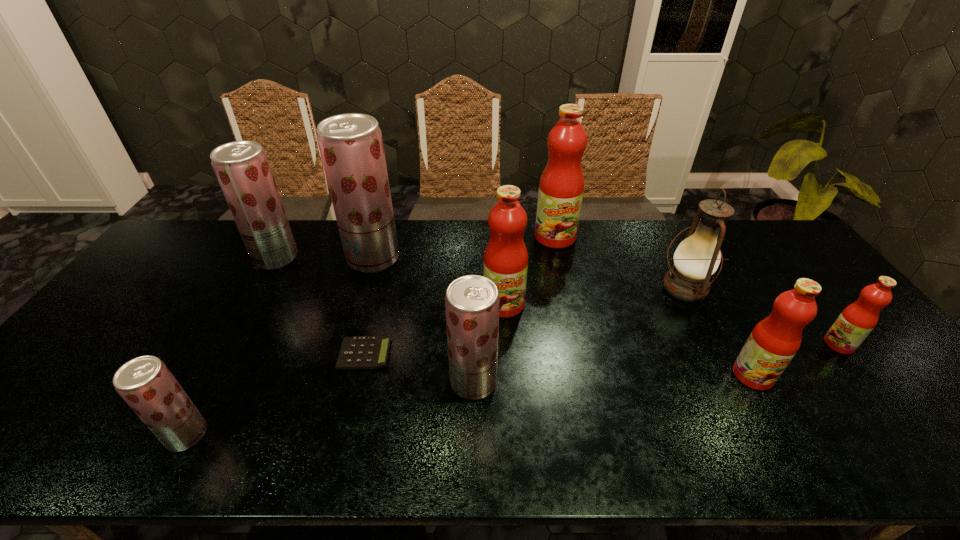
Where is `empty space between the third smallest strawberry fruit juice and the rightmost strawberry fruit juice`? empty space between the third smallest strawberry fruit juice and the rightmost strawberry fruit juice is located at coordinates (374, 320).

Where is `empty space between the nearest pink fruit juice and the shortest object`? This screenshot has height=540, width=960. empty space between the nearest pink fruit juice and the shortest object is located at coordinates (559, 364).

Find the location of a particular element. vacant space in between the third biggest strawberry fruit juice and the nearest strawberry fruit juice is located at coordinates (330, 408).

The width and height of the screenshot is (960, 540). What are the coordinates of `unoccupied area between the fourth object from right to left and the second biggest strawberry fruit juice` in the screenshot? It's located at (416, 247).

What are the coordinates of `vacant space that is in between the nearest strawberry fruit juice and the biggest pink fruit juice` in the screenshot? It's located at (371, 336).

Locate an element on the screen. vacant space in between the calculator and the leftmost pink fruit juice is located at coordinates (434, 329).

This screenshot has width=960, height=540. I want to click on free space between the rightmost object and the third fruit juice from left to right, so click(x=606, y=301).

The image size is (960, 540). I want to click on free area in between the biggest strawberry fruit juice and the third smallest strawberry fruit juice, so click(324, 258).

Where is `object that can be found as the third closest to the second fruit juice from right to left`? object that can be found as the third closest to the second fruit juice from right to left is located at coordinates (506, 258).

Choose which object is the ninth nearest neighbor to the second strawberry fruit juice from right to left. Please provide its 2D coordinates. Your answer should be formatted as a tuple, i.e. [(x, y)], where the tuple contains the x and y coordinates of a point satisfying the conditions above.

[(854, 324)]